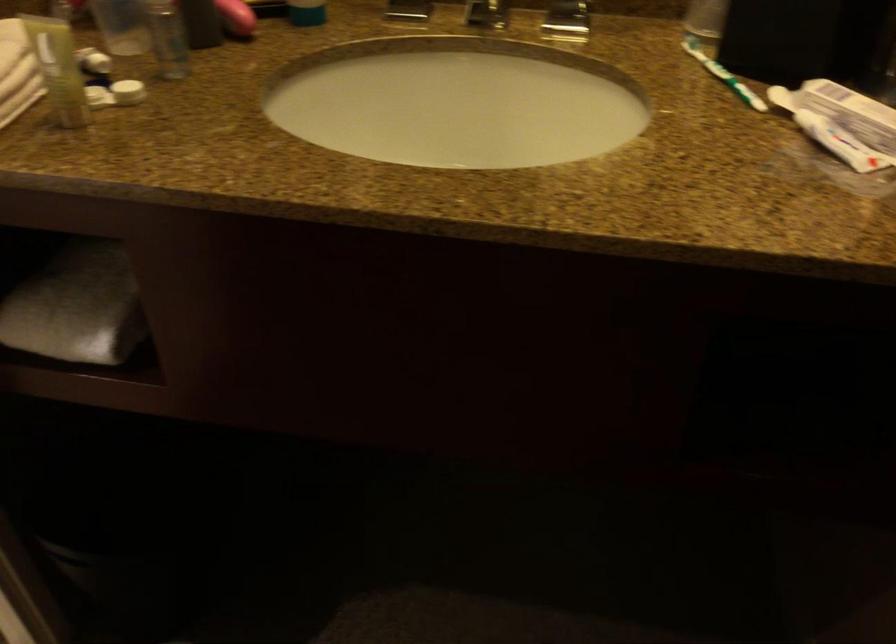
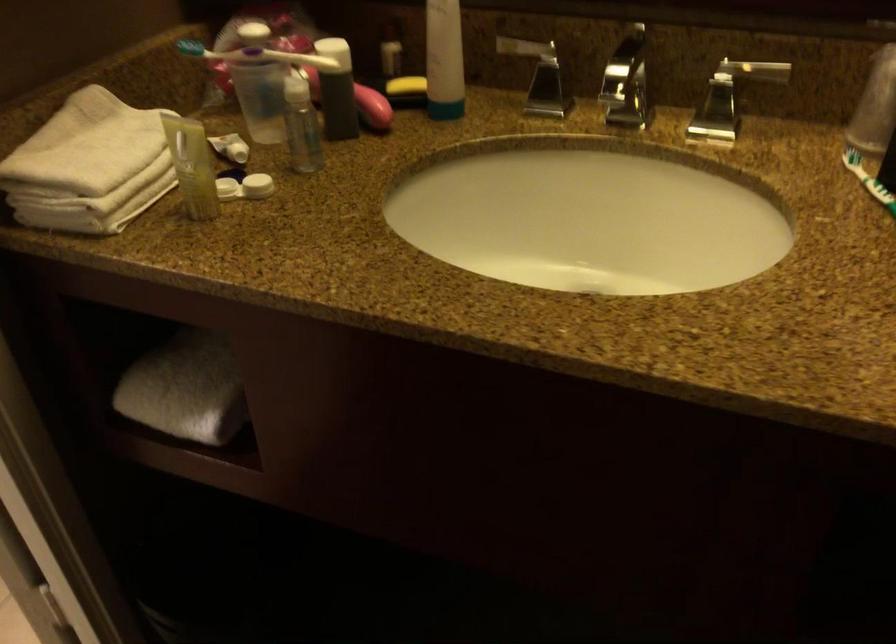
In the second image, find the point that corresponds to [71,310] in the first image.

(185, 389)